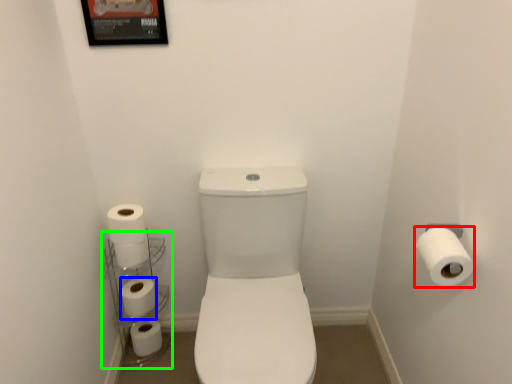
Question: Which object is the farthest from toilet paper (highlighted by a red box)? Choose among these: toilet paper (highlighted by a blue box) or shelf (highlighted by a green box).

Choices:
 (A) toilet paper
 (B) shelf

Answer: (B)